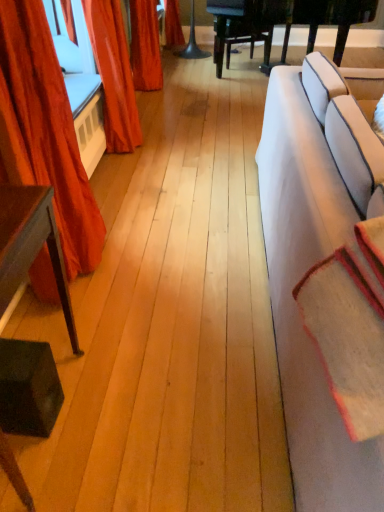
At what (x,y) coordinates should I click in order to perform the action: click on vacant area that lies in front of velvet orange curtain at upper left, which appears as the first curtain when viewed from the back. Please return your answer as a coordinate pair (x, y). Looking at the image, I should click on (133, 167).